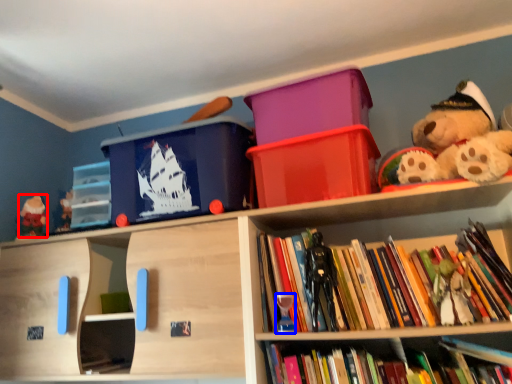
Question: Which point is further to the camera, toy (highlighted by a red box) or toy (highlighted by a blue box)?

Choices:
 (A) toy
 (B) toy

Answer: (A)